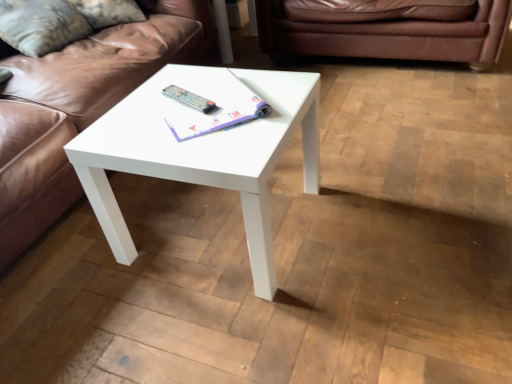
Locate an element on the screen. The width and height of the screenshot is (512, 384). free space in front of brown leather couch at center, which ranks as the 2th studio couch in left-to-right order is located at coordinates (407, 138).